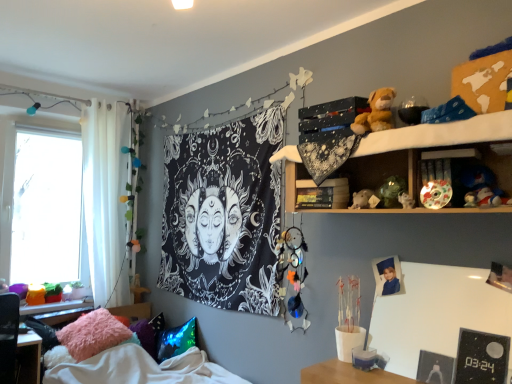
Question: From the image's perspective, is fuzzy fabric pillow at lower left, marked as the 2th pillow in a right-to-left arrangement, on white sheer curtain at left?

Choices:
 (A) no
 (B) yes

Answer: (A)

Question: Can you confirm if fuzzy fabric pillow at lower left, arranged as the second pillow when viewed from the left, is smaller than white sheer curtain at left?

Choices:
 (A) no
 (B) yes

Answer: (B)

Question: Can you confirm if fuzzy fabric pillow at lower left, marked as the 2th pillow in a right-to-left arrangement, is taller than white sheer curtain at left?

Choices:
 (A) yes
 (B) no

Answer: (B)

Question: Is fuzzy fabric pillow at lower left, marked as the 2th pillow in a right-to-left arrangement, looking in the opposite direction of white sheer curtain at left?

Choices:
 (A) no
 (B) yes

Answer: (A)

Question: Would you say fuzzy fabric pillow at lower left, arranged as the second pillow when viewed from the left, is outside white sheer curtain at left?

Choices:
 (A) no
 (B) yes

Answer: (B)

Question: Is fuzzy fabric pillow at lower left, marked as the 2th pillow in a right-to-left arrangement, at the left side of white sheer curtain at left?

Choices:
 (A) no
 (B) yes

Answer: (A)

Question: Is brown plush toy at upper right, the 4th toy viewed from the right, at the left side of fuzzy fabric pillow at lower left, marked as the 2th pillow in a right-to-left arrangement?

Choices:
 (A) no
 (B) yes

Answer: (A)

Question: Is brown plush toy at upper right, the sixth toy ordered from the bottom, bigger than fuzzy fabric pillow at lower left, arranged as the second pillow when viewed from the left?

Choices:
 (A) yes
 (B) no

Answer: (B)

Question: Would you say fuzzy fabric pillow at lower left, arranged as the second pillow when viewed from the left, is part of brown plush toy at upper right, the 4th toy viewed from the right,'s contents?

Choices:
 (A) no
 (B) yes

Answer: (A)

Question: Is the surface of brown plush toy at upper right, the sixth toy ordered from the bottom, in direct contact with fuzzy fabric pillow at lower left, marked as the 2th pillow in a right-to-left arrangement?

Choices:
 (A) yes
 (B) no

Answer: (B)

Question: Is brown plush toy at upper right, the 3th toy from the left, positioned before fuzzy fabric pillow at lower left, arranged as the second pillow when viewed from the left?

Choices:
 (A) yes
 (B) no

Answer: (A)

Question: Is brown plush toy at upper right, the sixth toy ordered from the bottom, at the right side of fuzzy fabric pillow at lower left, arranged as the second pillow when viewed from the left?

Choices:
 (A) no
 (B) yes

Answer: (B)

Question: Is shiny multicolored ball at upper right, marked as the 2th toy in a right-to-left arrangement, next to white sheer curtain at left?

Choices:
 (A) yes
 (B) no

Answer: (B)